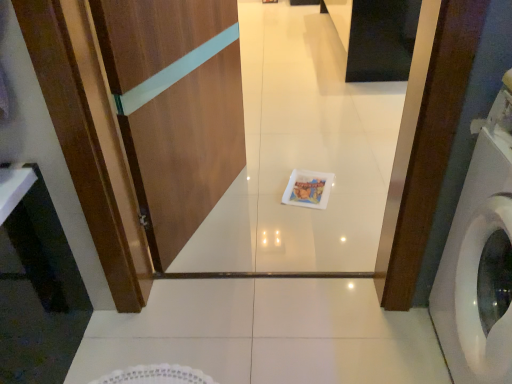
Question: Is white plastic washing machine at right positioned far away from black glossy cabinet at upper center?

Choices:
 (A) no
 (B) yes

Answer: (B)

Question: Could you tell me if white plastic washing machine at right is facing black glossy cabinet at upper center?

Choices:
 (A) yes
 (B) no

Answer: (B)

Question: Is white plastic washing machine at right closer to camera compared to black glossy cabinet at upper center?

Choices:
 (A) yes
 (B) no

Answer: (A)

Question: Is white plastic washing machine at right thinner than black glossy cabinet at upper center?

Choices:
 (A) no
 (B) yes

Answer: (B)

Question: Is white plastic washing machine at right beside black glossy cabinet at upper center?

Choices:
 (A) yes
 (B) no

Answer: (B)

Question: Considering the positions of black glossy cabinet at upper center and white plastic washing machine at right in the image, is black glossy cabinet at upper center wider or thinner than white plastic washing machine at right?

Choices:
 (A) wide
 (B) thin

Answer: (A)

Question: Based on their sizes in the image, would you say black glossy cabinet at upper center is bigger or smaller than white plastic washing machine at right?

Choices:
 (A) big
 (B) small

Answer: (A)

Question: From a real-world perspective, is black glossy cabinet at upper center physically located above or below white plastic washing machine at right?

Choices:
 (A) below
 (B) above

Answer: (A)

Question: Is black glossy cabinet at upper center to the left or to the right of white plastic washing machine at right in the image?

Choices:
 (A) left
 (B) right

Answer: (B)

Question: Considering their positions, is black glossy cabinet at upper center located in front of or behind wooden screen door at center?

Choices:
 (A) front
 (B) behind

Answer: (B)

Question: From their relative heights in the image, would you say black glossy cabinet at upper center is taller or shorter than wooden screen door at center?

Choices:
 (A) short
 (B) tall

Answer: (A)

Question: From a real-world perspective, is black glossy cabinet at upper center physically located above or below wooden screen door at center?

Choices:
 (A) above
 (B) below

Answer: (B)

Question: Is point (338, 16) closer or farther from the camera than point (211, 74)?

Choices:
 (A) closer
 (B) farther

Answer: (B)

Question: In terms of height, does white plastic washing machine at right look taller or shorter compared to black glossy cabinet at upper center?

Choices:
 (A) tall
 (B) short

Answer: (A)

Question: Based on their sizes in the image, would you say white plastic washing machine at right is bigger or smaller than black glossy cabinet at upper center?

Choices:
 (A) small
 (B) big

Answer: (A)